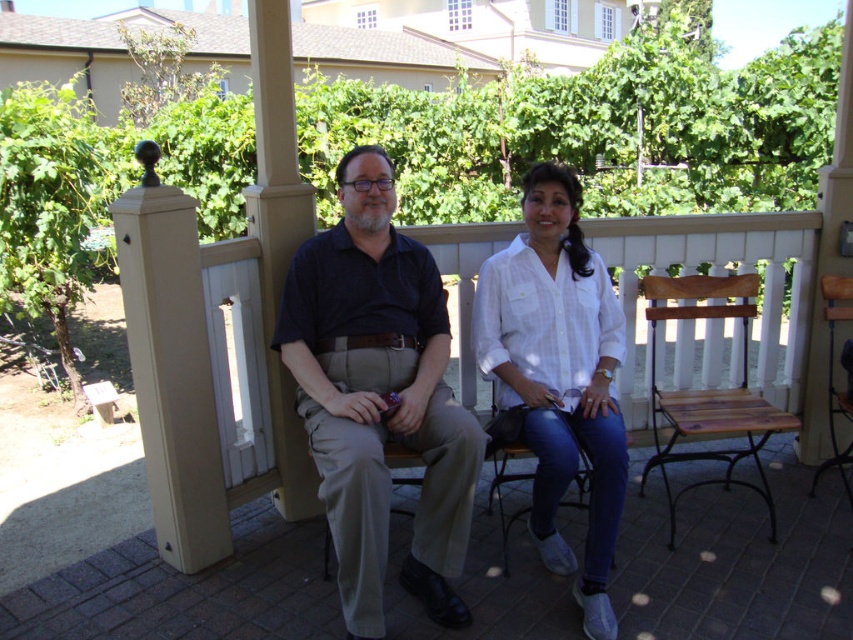
Question: Which of the following is the farthest from the observer?

Choices:
 (A) white cotton shirt at center
 (B) dark blue shirt at center

Answer: (A)

Question: Which object appears closest to the camera in this image?

Choices:
 (A) dark blue shirt at center
 (B) white cotton shirt at center

Answer: (A)

Question: Observing the image, what is the correct spatial positioning of dark blue shirt at center in reference to white cotton shirt at center?

Choices:
 (A) right
 (B) left

Answer: (B)

Question: Does dark blue shirt at center appear over white cotton shirt at center?

Choices:
 (A) yes
 (B) no

Answer: (A)

Question: Can you confirm if dark blue shirt at center is positioned above white cotton shirt at center?

Choices:
 (A) no
 (B) yes

Answer: (B)

Question: Which of the following is the farthest from the observer?

Choices:
 (A) wooden bench at center
 (B) white cotton shirt at center
 (C) dark blue shirt at center

Answer: (A)